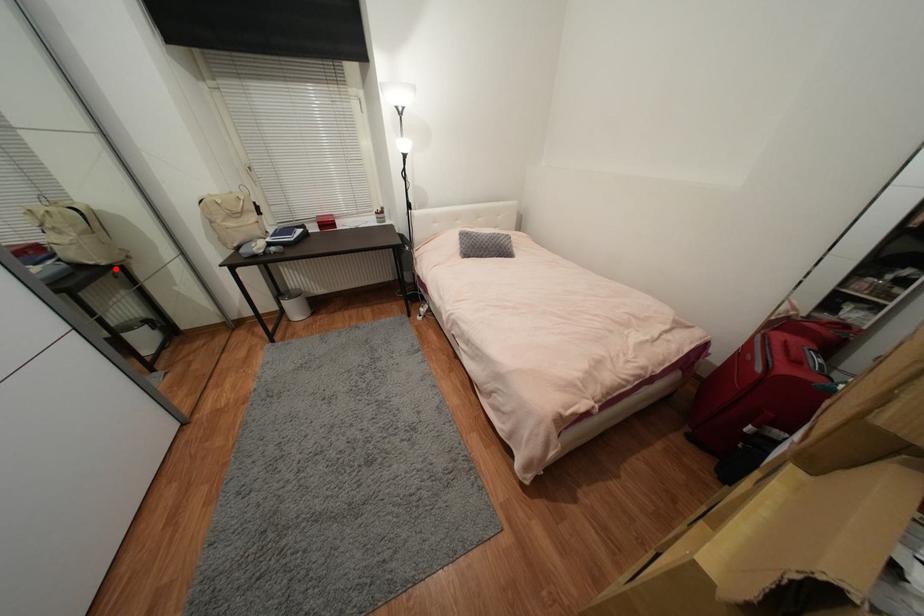
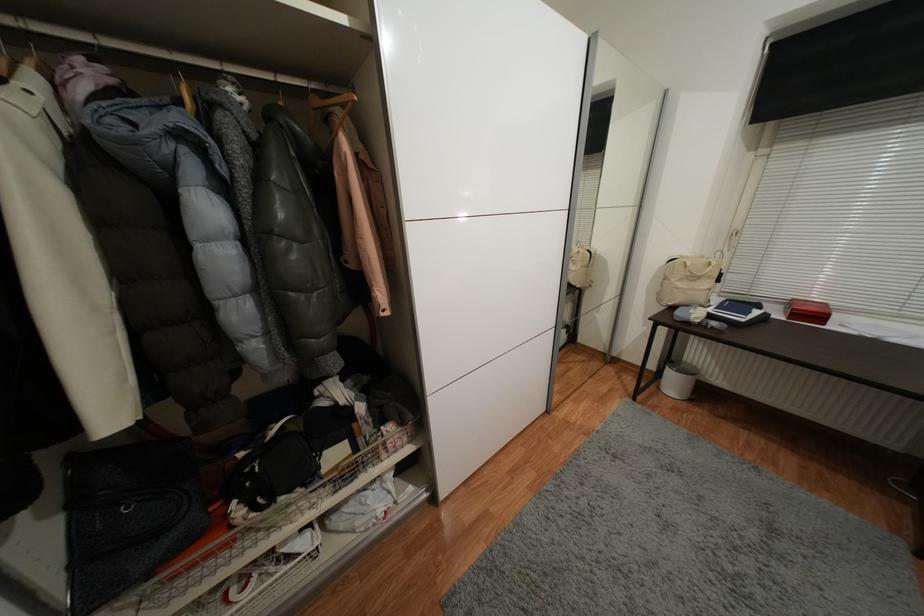
Where in the second image is the point corresponding to the highlighted location from the first image?

(582, 291)